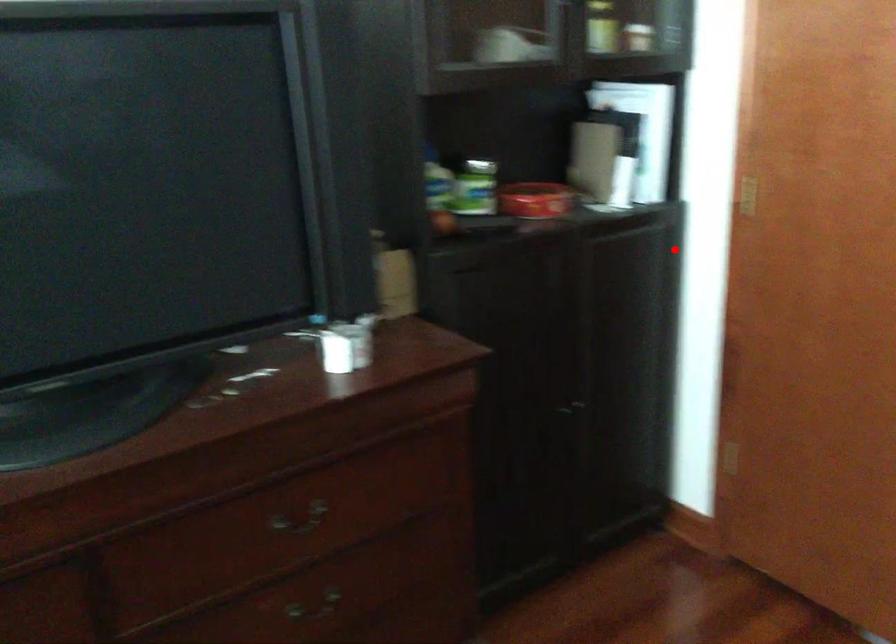
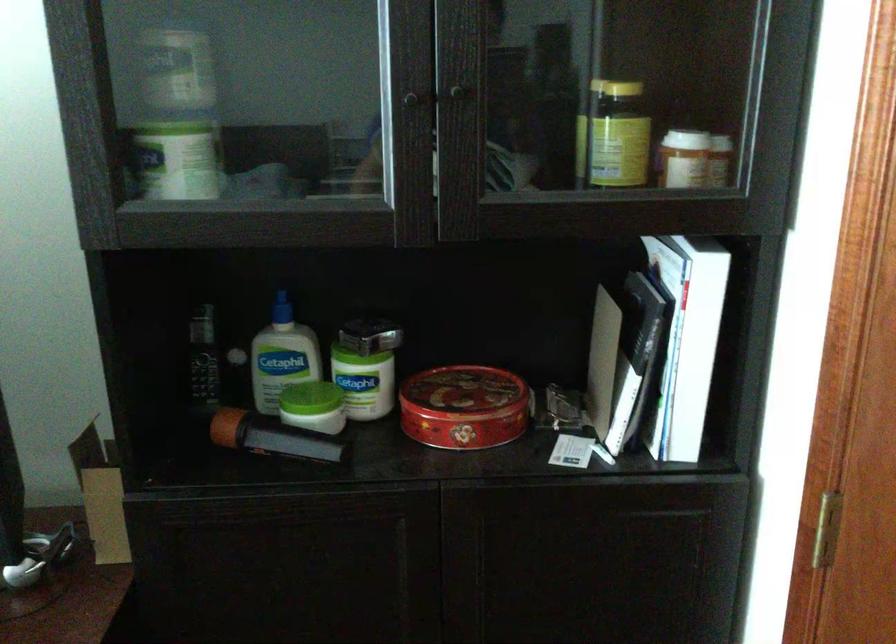
Question: I am providing you with two images of the same scene from different viewpoints. Image1 has a red point marked. In image2, the corresponding 3D location appears at what relative position? Reply with the corresponding letter.

Choices:
 (A) Closer
 (B) Farther

Answer: (A)